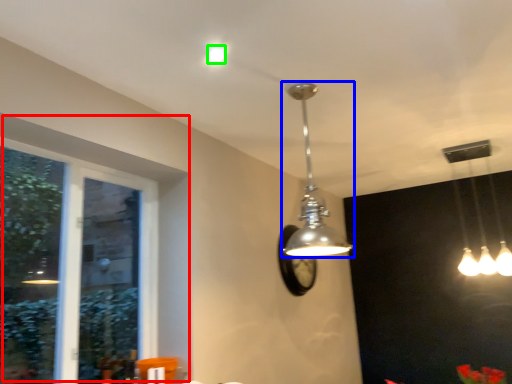
Question: Which is farther away from window (highlighted by a red box)? lamp (highlighted by a blue box) or droplight (highlighted by a green box)?

Choices:
 (A) lamp
 (B) droplight

Answer: (B)